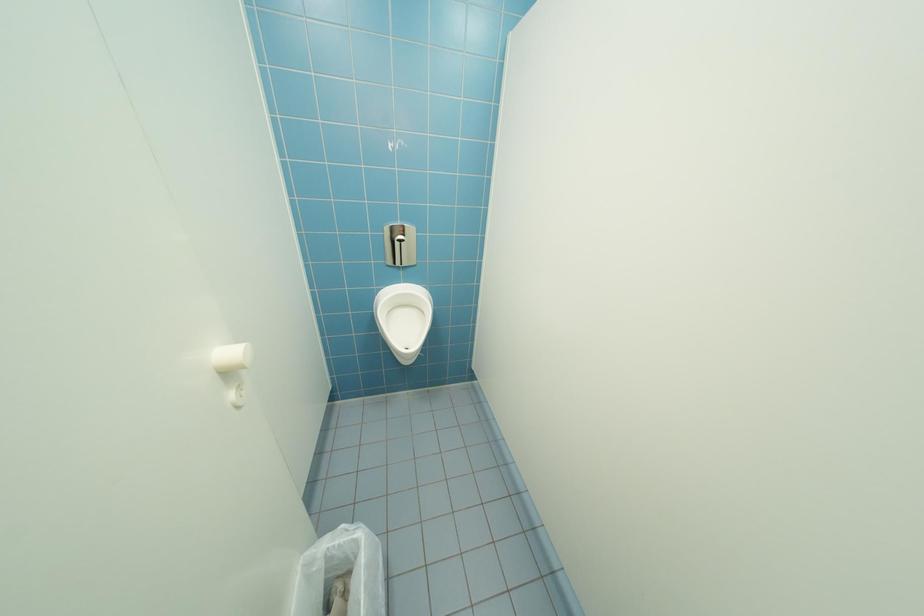
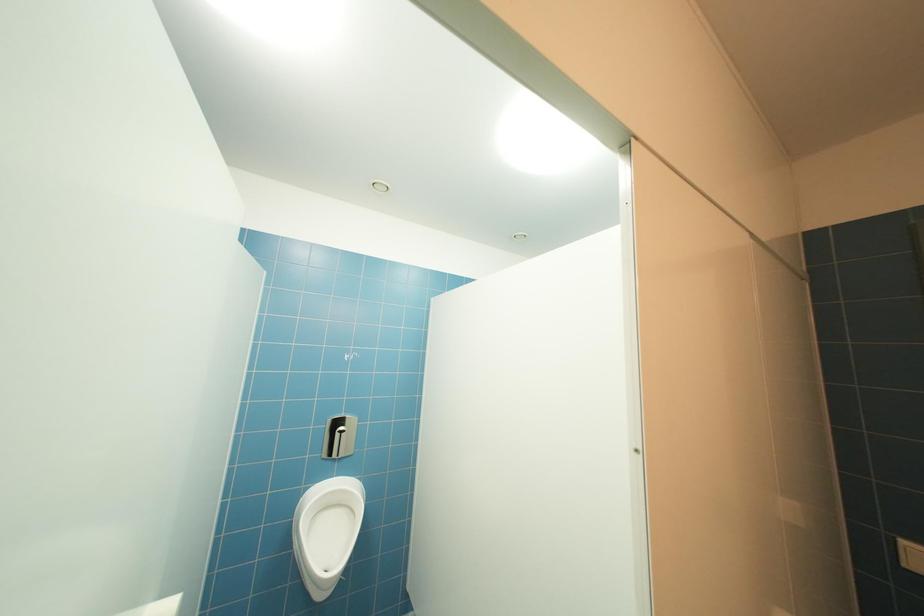
How did the camera likely rotate?

The rotation direction of the camera is right-up.